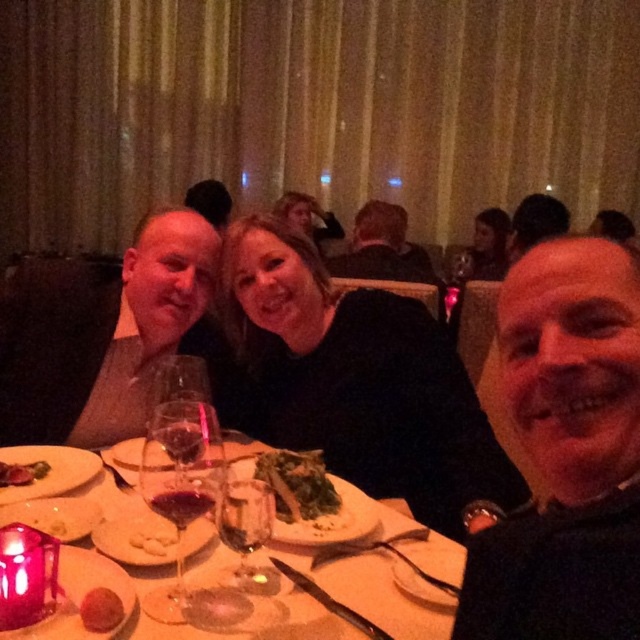
Question: Can you confirm if black matte dress at center is positioned to the left of matte glass plate at center?

Choices:
 (A) yes
 (B) no

Answer: (B)

Question: Among these objects, which one is farthest from the camera?

Choices:
 (A) black matte dress at center
 (B) black matte shirt at center
 (C) grilled meat steak at center left
 (D) green leafy salad at center

Answer: (A)

Question: Does green leafy salad at center appear over white creamy mashed potatoes at center?

Choices:
 (A) no
 (B) yes

Answer: (B)

Question: Estimate the real-world distances between objects in this image. Which object is closer to the matte glass plate at center?

Choices:
 (A) dark brown leather jacket at center
 (B) transparent glass wine glass at center
 (C) smooth red tomato at center
 (D) matte black dress at center

Answer: (C)

Question: Based on their relative distances, which object is nearer to the matte black dress at center?

Choices:
 (A) white creamy mashed potatoes at center
 (B) black matte dress at center
 (C) smooth red tomato at center
 (D) transparent glass at center

Answer: (B)

Question: Does matte black shirt at left appear on the right side of smooth red tomato at center?

Choices:
 (A) yes
 (B) no

Answer: (B)